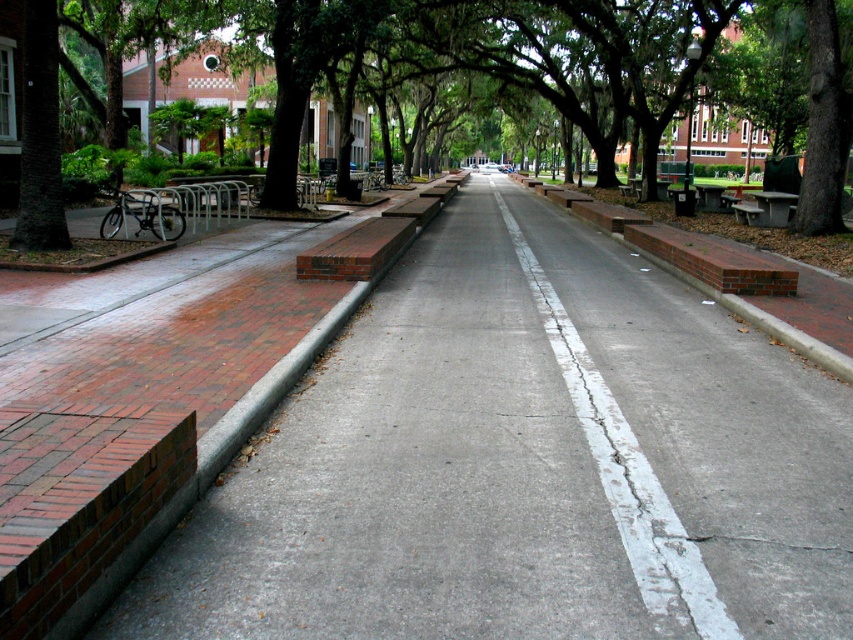
You are a delivery person trying to place a heavy box on a surface at the center of the street. Which object between the white cracked concrete at center and the gray concrete bench at center would be more suitable for placing the box?

The gray concrete bench at center is more suitable because it is shorter than the white cracked concrete at center, making it easier to place the box without needing to lift it too high.

You are a pedestrian walking along the street and want to sit down. You see the white cracked concrete at center and the gray concrete bench at center. Which one is closer to the left side of the street?

The white cracked concrete at center is to the left of the gray concrete bench at center, so it is closer to the left side of the street.

You are standing at the point marked by the coordinates point (x=602, y=58). What object is located exactly at that point?

The point (x=602, y=58) marks the green leafy tree at center.